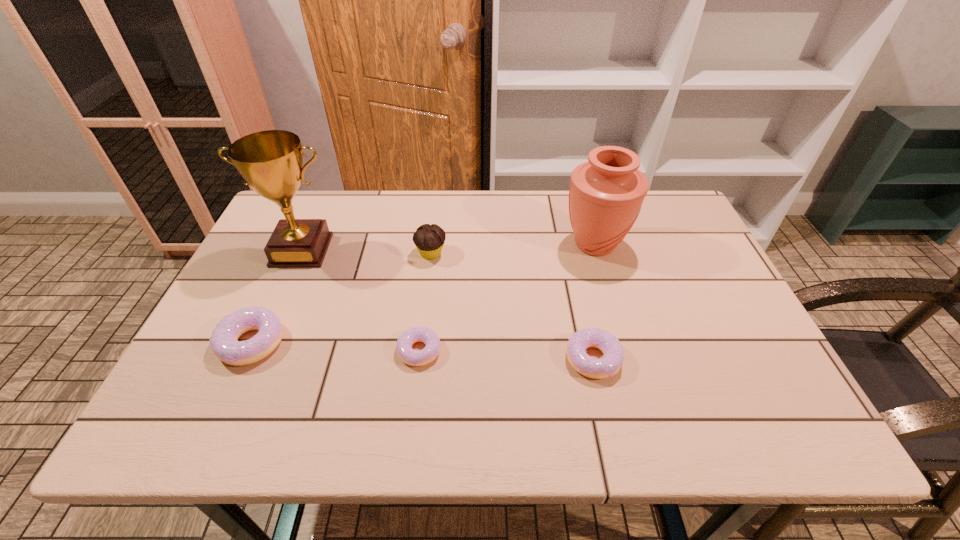
The image size is (960, 540). What are the coordinates of `vacant space that satisfies the following two spatial constraints: 1. on the plaque of the award; 2. on the right side of the muffin` in the screenshot? It's located at (300, 254).

At what (x,y) coordinates should I click in order to perform the action: click on free spot that satisfies the following two spatial constraints: 1. on the plaque of the shortest doughnut; 2. on the right side of the award. Please return your answer as a coordinate pair (x, y). This screenshot has height=540, width=960. Looking at the image, I should click on (257, 350).